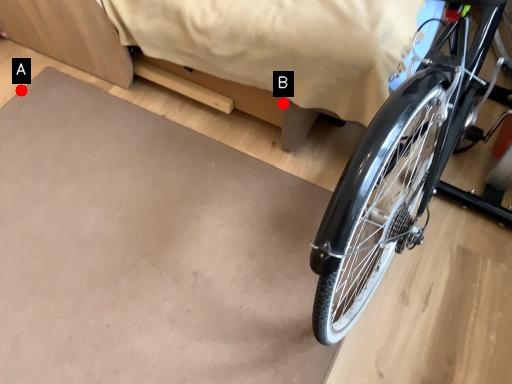
Question: Two points are circled on the image, labeled by A and B beside each circle. Which point is closer to the camera taking this photo?

Choices:
 (A) A is closer
 (B) B is closer

Answer: (B)